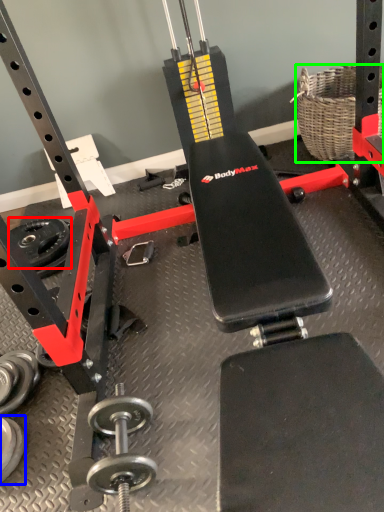
Question: Based on their relative distances, which object is nearer to wheel (highlighted by a red box)? Choose from dumbbell (highlighted by a blue box) and basket (highlighted by a green box).

Choices:
 (A) dumbbell
 (B) basket

Answer: (A)